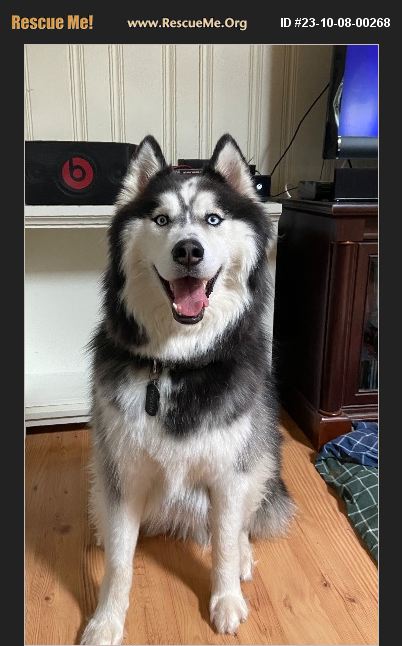
I want to click on wooden floor, so click(303, 566).